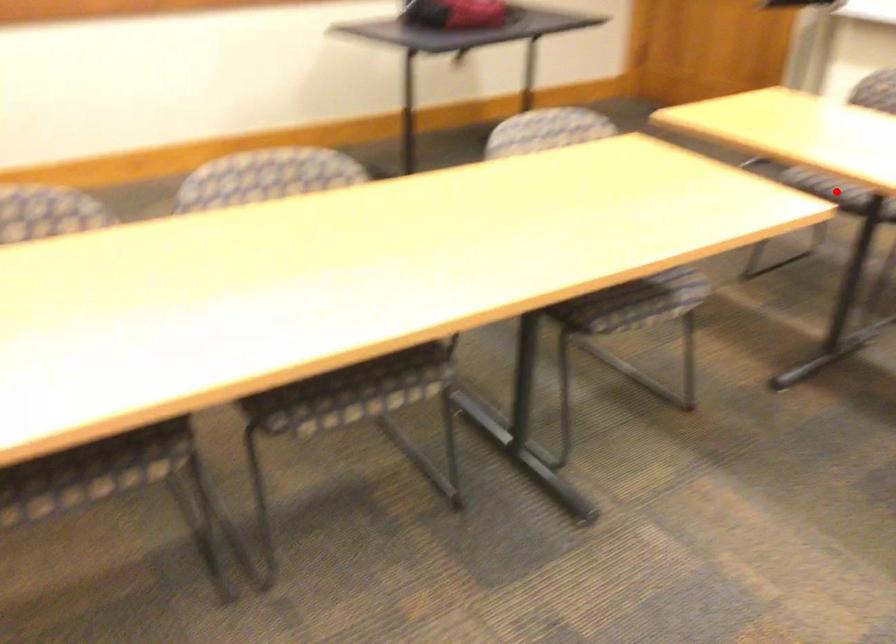
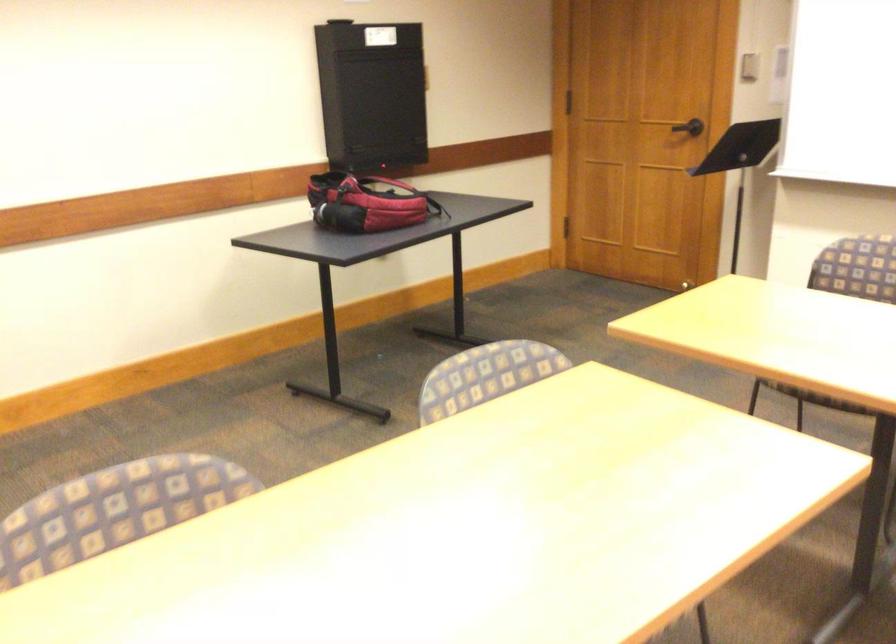
Question: I am providing you with two images of the same scene from different viewpoints. A red point is marked on the first image. Can you still see the location of the red point in image 2?

Choices:
 (A) Yes
 (B) No

Answer: (B)